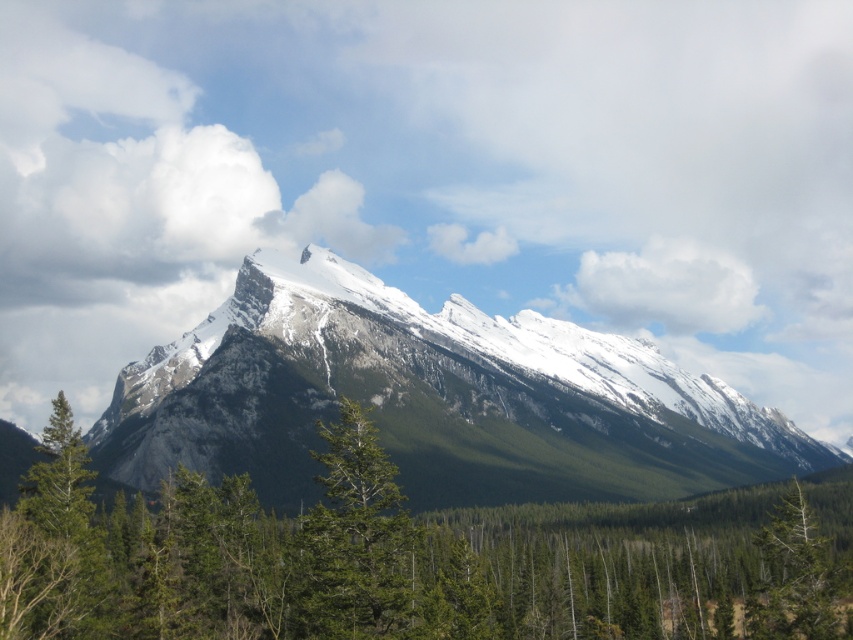
Who is lower down, white fluffy cloud at upper center or green matte tree at lower right?

Positioned lower is green matte tree at lower right.

In the scene shown: Between white fluffy cloud at upper center and green matte tree at lower right, which one has more height?

With more height is white fluffy cloud at upper center.

Who is more forward, [637,307] or [770,580]?

Point [770,580] is more forward.

Where is `white fluffy cloud at upper center`? The image size is (853, 640). white fluffy cloud at upper center is located at coordinates (666, 285).

Is snowy granite mountain range at center bigger than green matte tree at center?

Yes, snowy granite mountain range at center is bigger than green matte tree at center.

Is snowy granite mountain range at center above green matte tree at center?

Indeed, snowy granite mountain range at center is positioned over green matte tree at center.

Is point (248, 364) behind point (390, 593)?

Yes, point (248, 364) is farther from viewer.

Find the location of `snowy granite mountain range at center`. snowy granite mountain range at center is located at coordinates (431, 400).

Who is positioned more to the left, green leafy tree at center or green matte tree at center?

From the viewer's perspective, green matte tree at center appears more on the left side.

Can you confirm if green leafy tree at center is smaller than green matte tree at center?

Incorrect, green leafy tree at center is not smaller in size than green matte tree at center.

What do you see at coordinates (392, 563) in the screenshot? This screenshot has height=640, width=853. I see `green leafy tree at center` at bounding box center [392, 563].

Find the location of a particular element. green leafy tree at center is located at coordinates (392, 563).